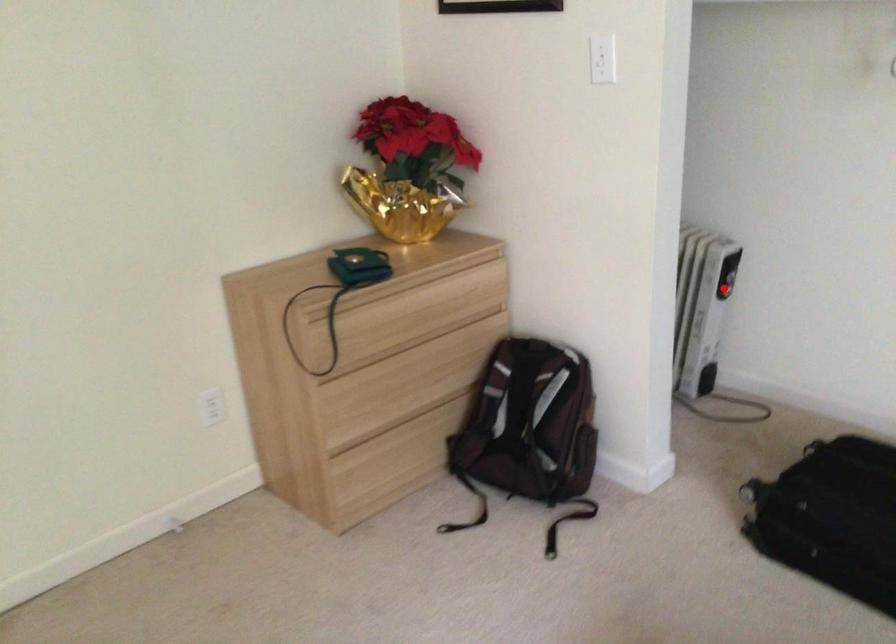
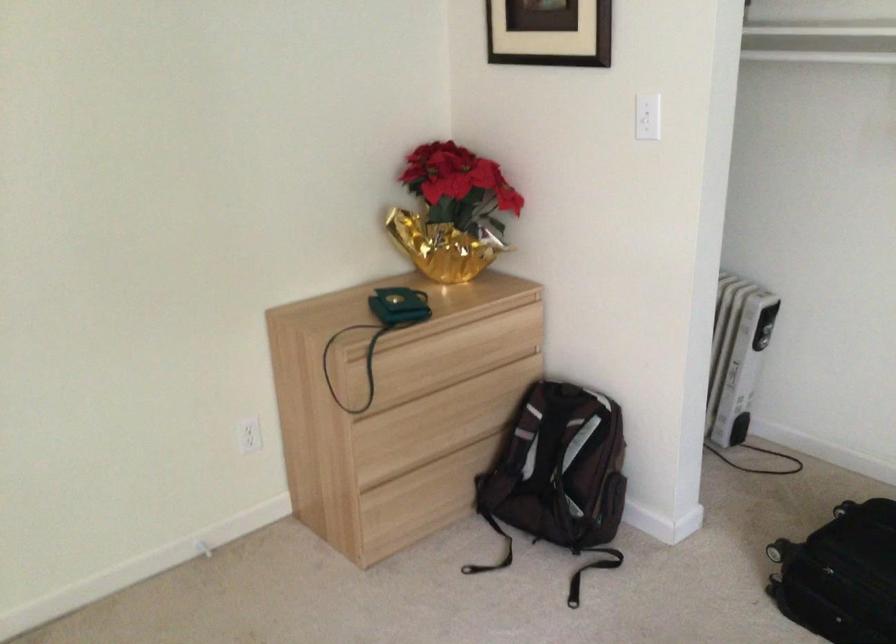
The point at the highlighted location is marked in the first image. Where is the corresponding point in the second image?

(761, 339)